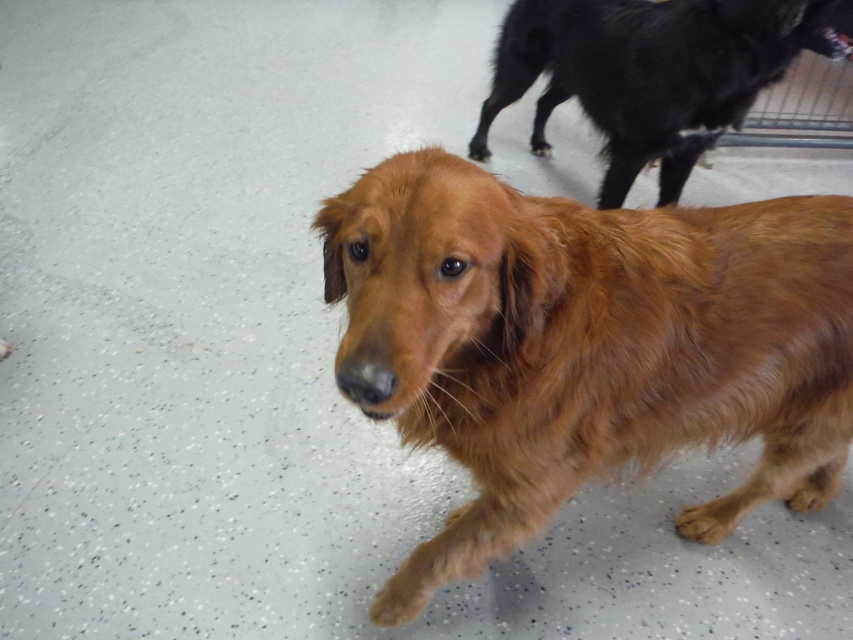
Question: Is shiny golden fur dog at center below shiny black dog at upper right?

Choices:
 (A) yes
 (B) no

Answer: (A)

Question: Which of the following is the closest to the observer?

Choices:
 (A) shiny black dog at upper right
 (B) shiny golden fur dog at center

Answer: (B)

Question: From the image, what is the correct spatial relationship of shiny golden fur dog at center in relation to shiny black dog at upper right?

Choices:
 (A) right
 (B) left

Answer: (B)

Question: Considering the relative positions of shiny golden fur dog at center and shiny black dog at upper right in the image provided, where is shiny golden fur dog at center located with respect to shiny black dog at upper right?

Choices:
 (A) below
 (B) above

Answer: (A)